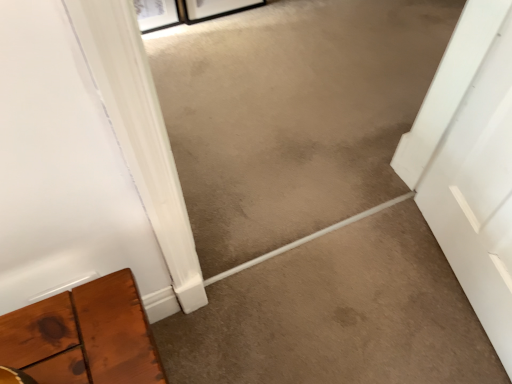
Identify the location of brown carpet at center. The width and height of the screenshot is (512, 384). (337, 315).

What do you see at coordinates (337, 315) in the screenshot? I see `brown carpet at center` at bounding box center [337, 315].

Locate an element on the screen. brown carpet at center is located at coordinates (337, 315).